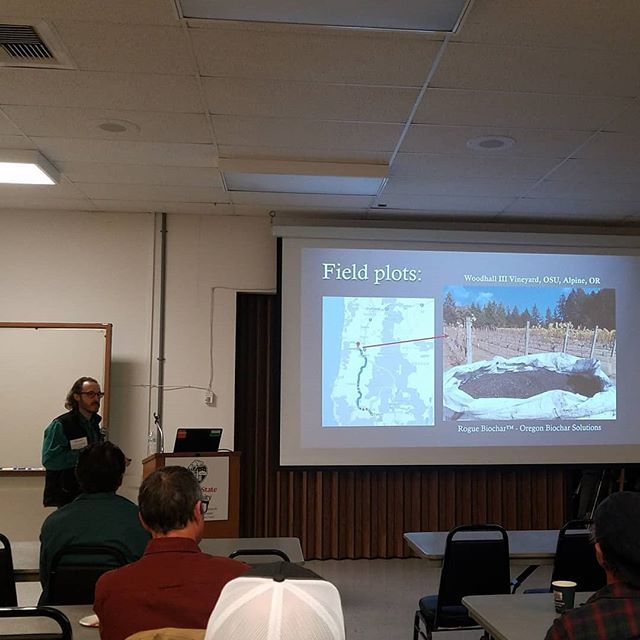
Image resolution: width=640 pixels, height=640 pixels. Identify the location of white table on left side of room. (287, 541).